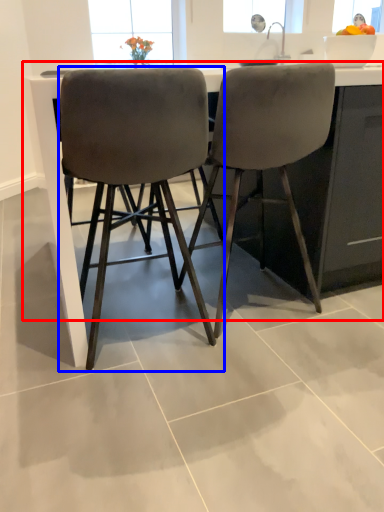
Question: Which object appears farthest to the camera in this image, counter (highlighted by a red box) or chair (highlighted by a blue box)?

Choices:
 (A) counter
 (B) chair

Answer: (A)